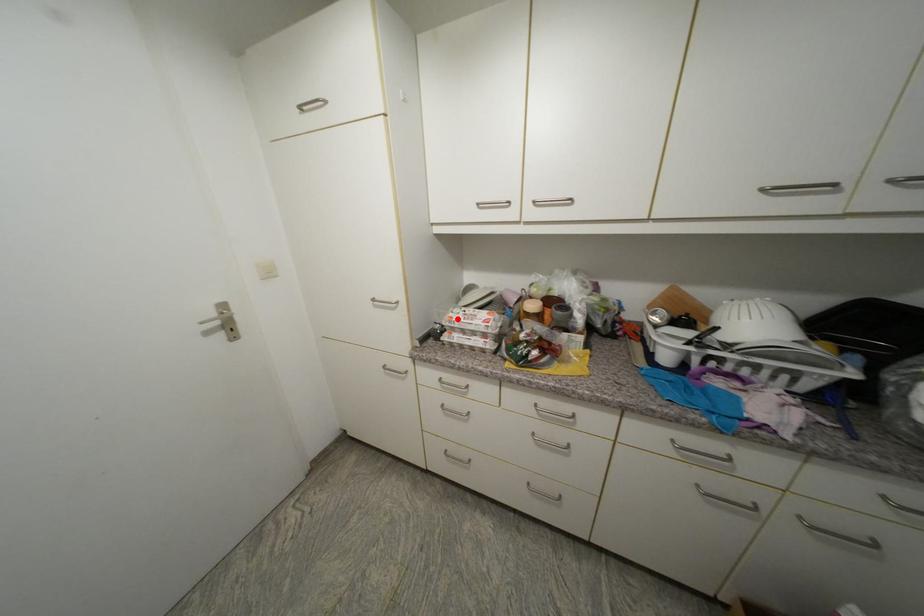
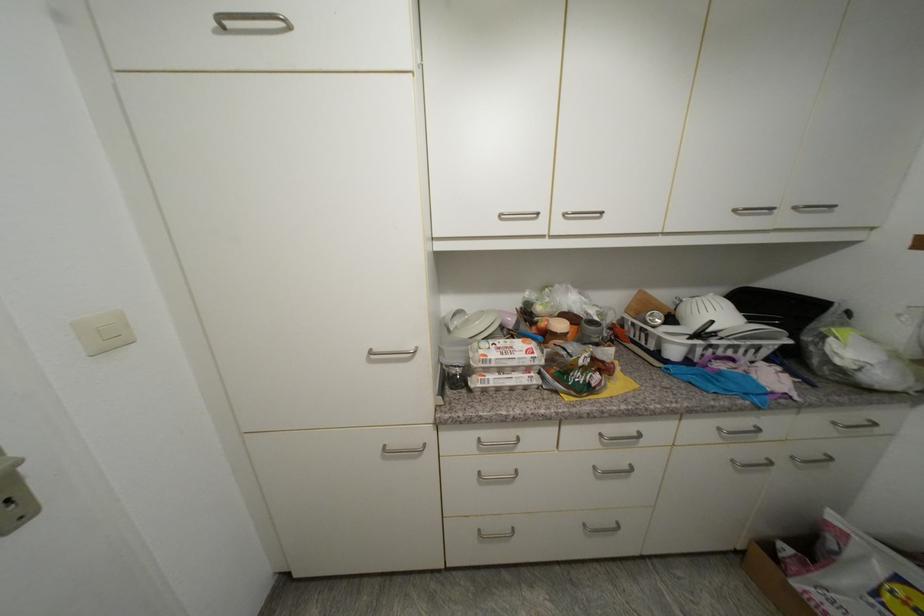
The point at the highlighted location is marked in the first image. Where is the corresponding point in the second image?

(492, 357)